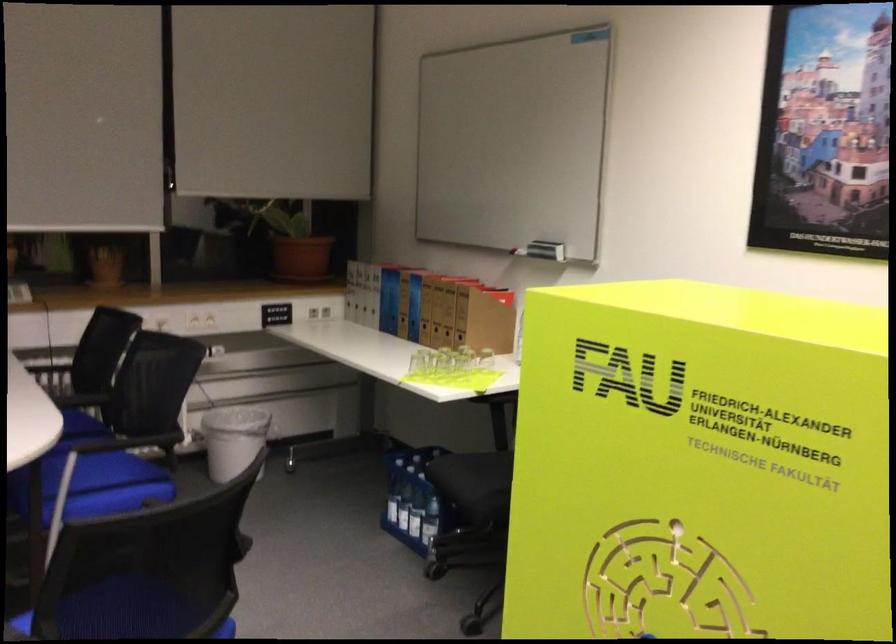
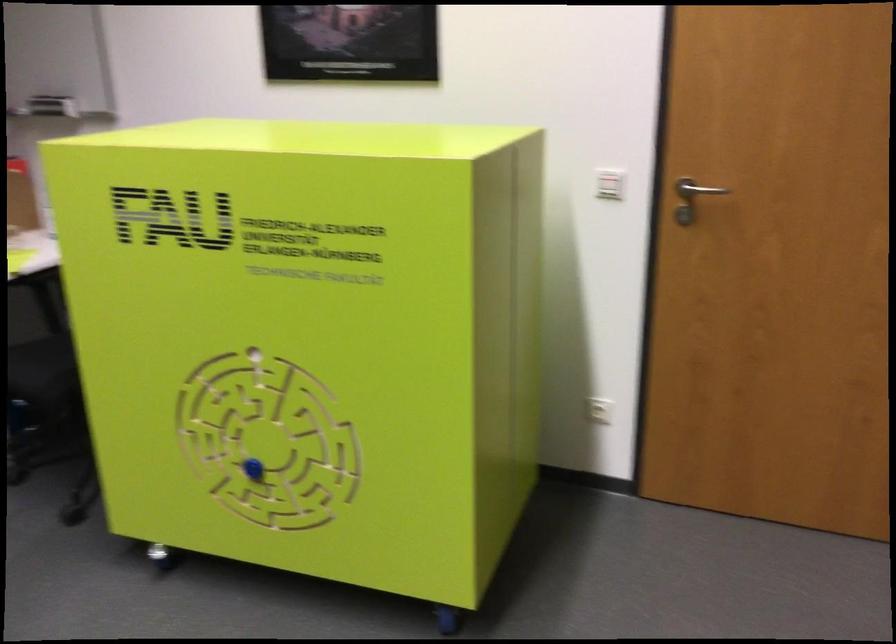
Question: The images are taken continuously from a first-person perspective. In which direction is your viewpoint rotating?

Choices:
 (A) Left
 (B) Right
 (C) Up
 (D) Down

Answer: (B)